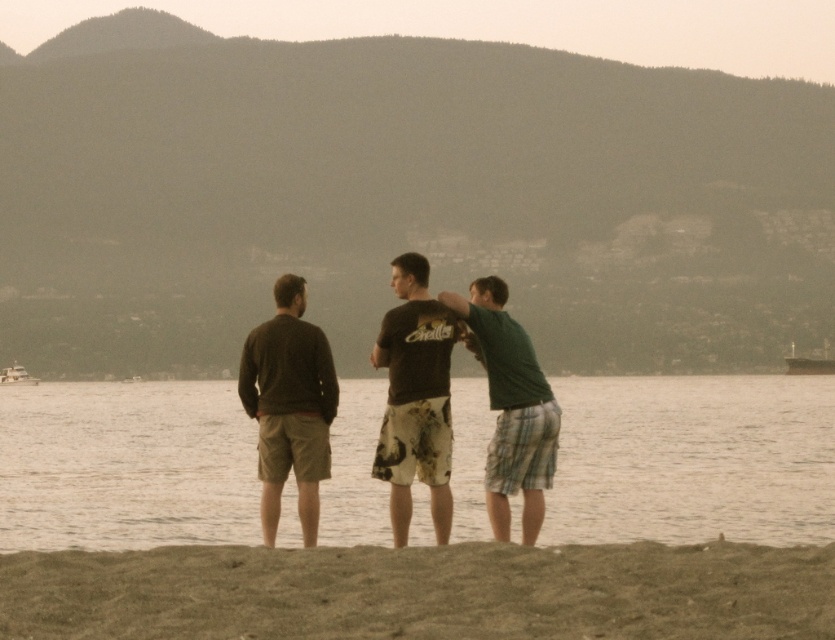
You are a photographer trying to capture a group photo of the dark brown sweater at center and the green plaid shorts at center. Since you want to ensure both subjects are in focus, you need to know their heights. Which of the two is taller?

The dark brown sweater at center is taller than the green plaid shorts at center, so you should adjust your camera settings to account for the height difference to ensure both are in focus.

You are a lifeguard standing on the brown sandy beach at lower center and need to reach the smooth water at center to rescue someone. Considering the distance between them, can you make it in under 30 seconds if you run at a speed of 10 feet per second?

The distance between the smooth water at center and brown sandy beach at lower center is 206.14 feet. At a running speed of 10 feet per second, it would take approximately 20.6 seconds to cover that distance. Therefore, yes, you can reach the smooth water at center in under 30 seconds.

You are standing on the brown sandy beach at lower center and want to reach the smooth water at center. Which direction should you walk to get there?

Answer: Since the smooth water at center is below the brown sandy beach at lower center, you should walk forward towards the direction of the smooth water at center to reach it.